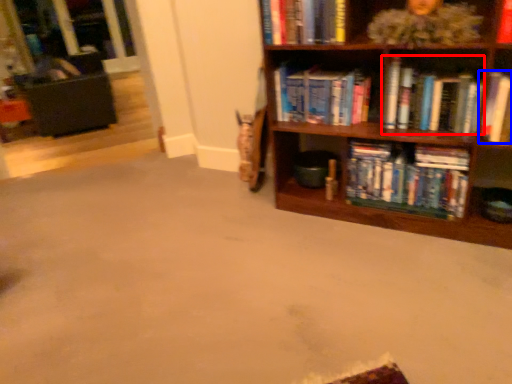
Question: Among these objects, which one is nearest to the camera, book (highlighted by a red box) or book (highlighted by a blue box)?

Choices:
 (A) book
 (B) book

Answer: (B)